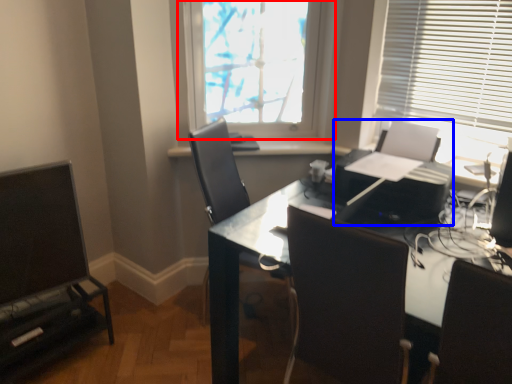
Question: Which object is further to the camera taking this photo, window (highlighted by a red box) or printer (highlighted by a blue box)?

Choices:
 (A) window
 (B) printer

Answer: (A)